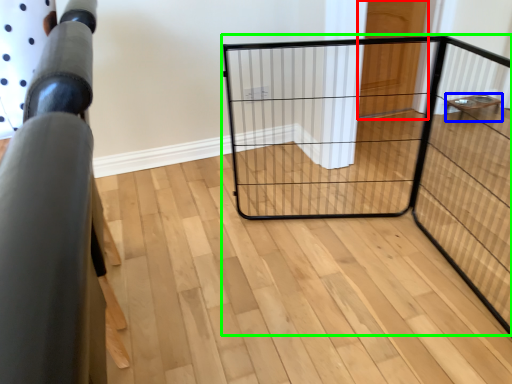
Question: Estimate the real-world distances between objects in this image. Which object is farther from door (highlighted by a red box), furniture (highlighted by a blue box) or cage (highlighted by a green box)?

Choices:
 (A) furniture
 (B) cage

Answer: (A)